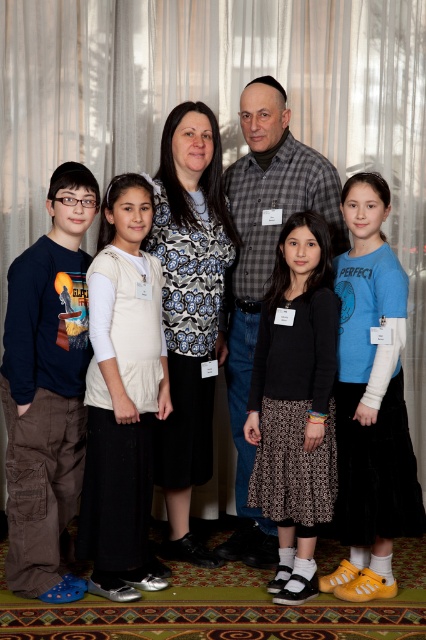
Is the position of matte blue shirt at left more distant than that of blue velvety shirt at right?

No, matte blue shirt at left is closer to the viewer.

Who is shorter, matte blue shirt at left or blue velvety shirt at right?

With less height is matte blue shirt at left.

The image size is (426, 640). I want to click on matte blue shirt at left, so click(46, 388).

Can you confirm if white cotton shirt at center is positioned above floral-patterned blouse at center?

No.

Who is positioned more to the left, white cotton shirt at center or floral-patterned blouse at center?

From the viewer's perspective, white cotton shirt at center appears more on the left side.

Describe the element at coordinates (121, 394) in the screenshot. I see `white cotton shirt at center` at that location.

Find the location of a particular element. This screenshot has height=640, width=426. white cotton shirt at center is located at coordinates (121, 394).

Between point (51, 522) and point (175, 481), which one is positioned in front?

Point (51, 522) is in front.

Between matte blue shirt at left and floral-patterned blouse at center, which one is positioned lower?

matte blue shirt at left is lower down.

Who is more forward, [69,352] or [178,339]?

Positioned in front is point [69,352].

Where is `matte blue shirt at left`? This screenshot has width=426, height=640. matte blue shirt at left is located at coordinates 46,388.